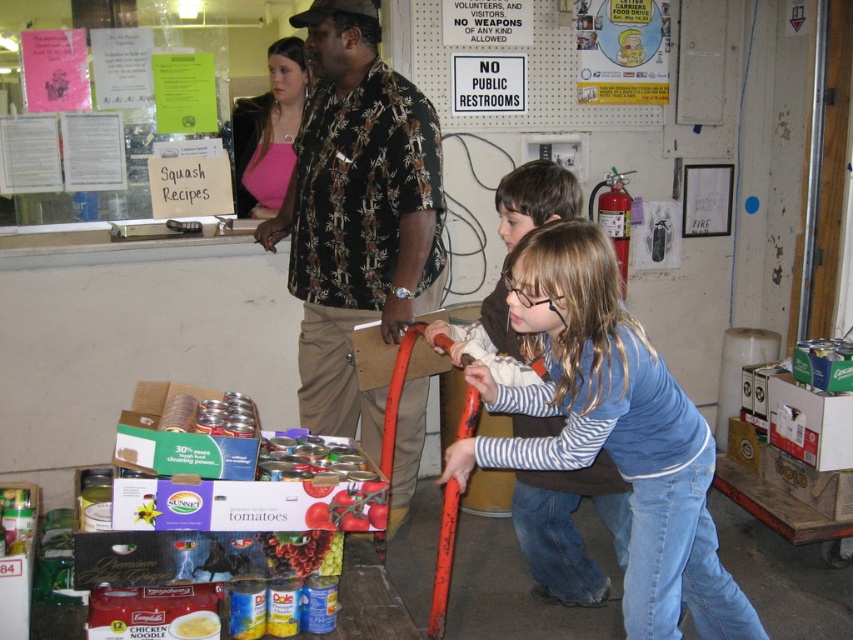
You are a volunteer at the community center and need to locate the blue striped shirt at center and the matte yellow can at lower left. Based on the scene description, which object is located to the left of the other?

The matte yellow can at lower left is positioned to the left of the blue striped shirt at center.

You are a photographer setting up for a group photo. You need to ensure that both the printed fabric shirt at center and the pink matte shirt at upper center are in focus. Given that your camera has a depth of field that can cover objects within 25 inches of each other, will you need to adjust your focus to include both?

The printed fabric shirt at center and the pink matte shirt at upper center are 26.49 inches apart from each other. Since the distance between them exceeds the camera depth of field coverage of 25 inches, you will need to adjust the focus to ensure both are in focus.

You are a volunteer at the food pantry and need to retrieve a can from the cart. Which can, the shiny metallic can at center or the matte yellow can at lower left, is easier to reach without moving the other?

The shiny metallic can at center is easier to reach because it is closer to you than the matte yellow can at lower left.